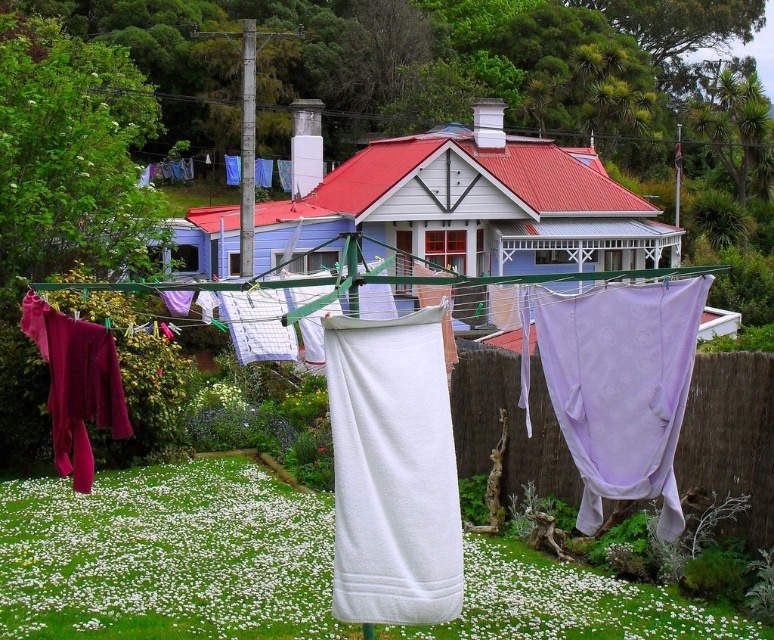
Question: Which is nearer to the lavender sheer fabric at center?

Choices:
 (A) white towel at center
 (B) white soft grass at center
 (C) velvet maroon pants at lower left

Answer: (A)

Question: Is white towel at center smaller than lavender sheer fabric at center?

Choices:
 (A) no
 (B) yes

Answer: (B)

Question: Is white soft grass at center below lavender sheer fabric at center?

Choices:
 (A) no
 (B) yes

Answer: (B)

Question: Which object appears closest to the camera in this image?

Choices:
 (A) white soft grass at center
 (B) lavender sheer fabric at center

Answer: (B)

Question: Which object is the farthest from the white towel at center?

Choices:
 (A) velvet maroon pants at lower left
 (B) white fabric at center
 (C) white soft grass at center

Answer: (B)

Question: Is white soft grass at center below white fabric at center?

Choices:
 (A) no
 (B) yes

Answer: (B)